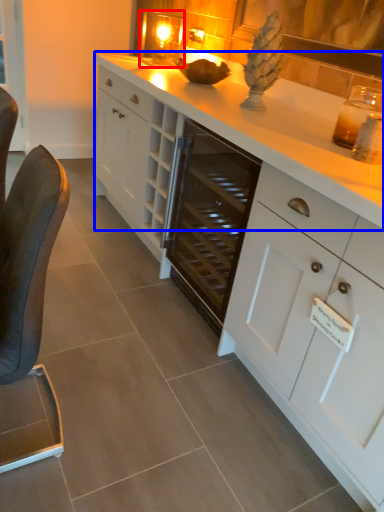
Question: Which of the following is the closest to the observer, candle holder (highlighted by a red box) or countertop (highlighted by a blue box)?

Choices:
 (A) candle holder
 (B) countertop

Answer: (B)